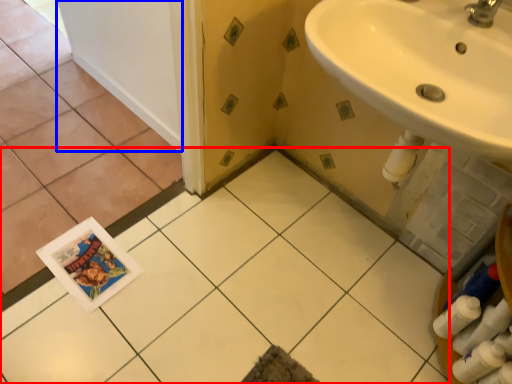
Question: Which object appears farthest to the camera in this image, ceramic tile (highlighted by a red box) or door (highlighted by a blue box)?

Choices:
 (A) ceramic tile
 (B) door

Answer: (B)